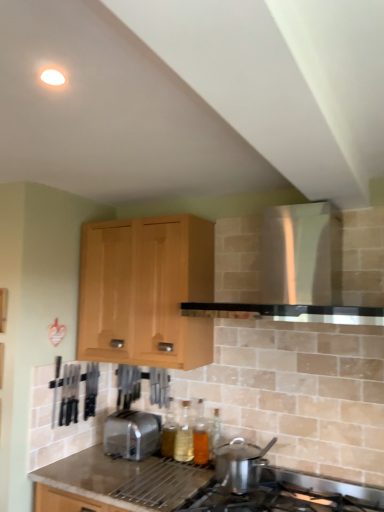
Where is `vacant region below light wood cabinet at upper center (from a real-world perspective)`? The height and width of the screenshot is (512, 384). vacant region below light wood cabinet at upper center (from a real-world perspective) is located at coordinates (150, 463).